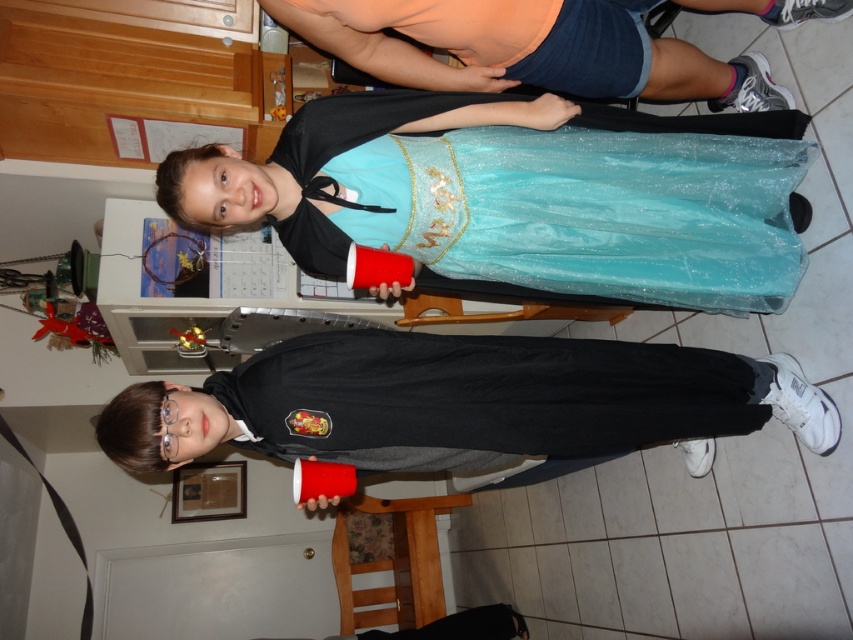
Can you confirm if matte orange shorts at upper center is positioned below shiny teal dress at center?

Incorrect, matte orange shorts at upper center is not positioned below shiny teal dress at center.

Consider the image. Who is more forward, (469, 77) or (331, 132)?

Point (331, 132)

Is point (450, 24) positioned in front of point (305, 184)?

Yes, point (450, 24) is in front of point (305, 184).

What are the coordinates of `matte orange shorts at upper center` in the screenshot? It's located at (527, 49).

Can you confirm if matte black hoodie at lower center is bigger than shiny teal dress at center?

Yes.

In order to click on matte black hoodie at lower center in this screenshot , I will do `click(463, 403)`.

The height and width of the screenshot is (640, 853). What do you see at coordinates (463, 403) in the screenshot?
I see `matte black hoodie at lower center` at bounding box center [463, 403].

Find the location of a particular element. matte black hoodie at lower center is located at coordinates (x=463, y=403).

Can you confirm if matte black hoodie at lower center is taller than matte orange shorts at upper center?

Correct, matte black hoodie at lower center is much taller as matte orange shorts at upper center.

Who is higher up, matte black hoodie at lower center or matte orange shorts at upper center?

Positioned higher is matte orange shorts at upper center.

Where is `matte black hoodie at lower center`? This screenshot has width=853, height=640. matte black hoodie at lower center is located at coordinates (463, 403).

In order to click on matte black hoodie at lower center in this screenshot , I will do `click(463, 403)`.